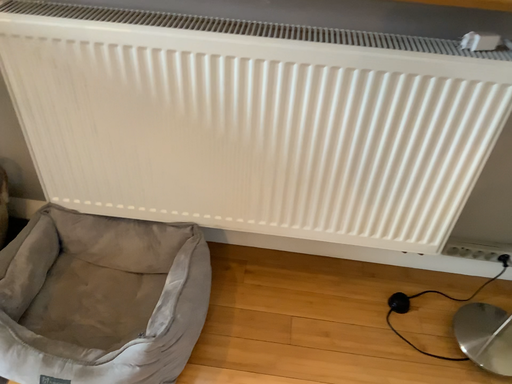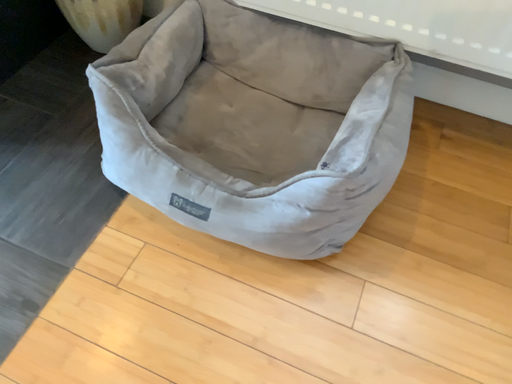
Question: How did the camera likely rotate when shooting the video?

Choices:
 (A) rotated downward
 (B) rotated upward

Answer: (A)